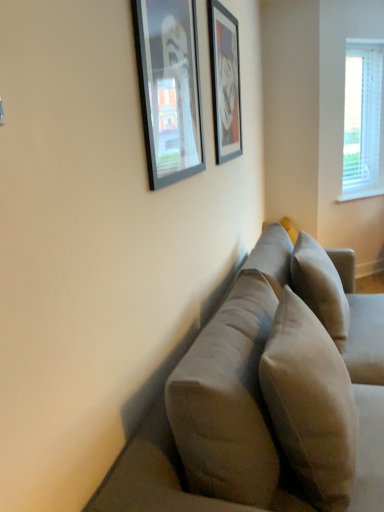
Question: Is point (196, 437) closer or farther from the camera than point (223, 115)?

Choices:
 (A) closer
 (B) farther

Answer: (A)

Question: From a real-world perspective, relative to matte black picture frame at upper center, acting as the 1th picture frame starting from the right, is suede-like beige couch at center vertically above or below?

Choices:
 (A) above
 (B) below

Answer: (B)

Question: Which object is the farthest from the matte black picture frame at upper center, which is the second picture frame in right-to-left order?

Choices:
 (A) white blinds at upper right
 (B) beige fabric pillow at center, arranged as the 1th pillow when viewed from the back
 (C) suede-like beige couch at center
 (D) suede-like beige pillow at center, which is the 2th pillow from back to front
 (E) matte black picture frame at upper center, acting as the 1th picture frame starting from the right

Answer: (A)

Question: Which object is the farthest from the white blinds at upper right?

Choices:
 (A) matte black picture frame at upper center, acting as the 1th picture frame starting from the right
 (B) matte black picture frame at upper center, which is the second picture frame in right-to-left order
 (C) suede-like beige couch at center
 (D) beige fabric pillow at center, arranged as the second pillow when viewed from the front
 (E) suede-like beige pillow at center, the first pillow viewed from the front

Answer: (E)